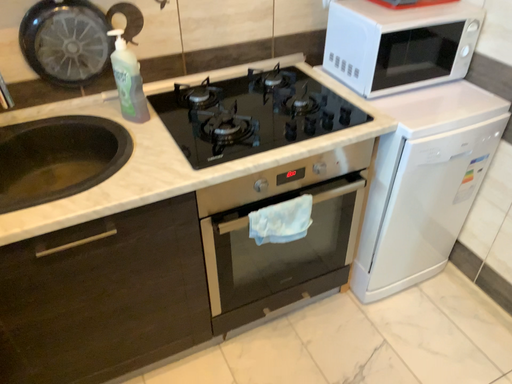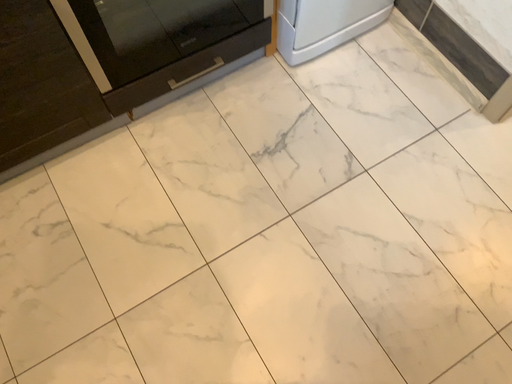
Question: Which way did the camera rotate in the video?

Choices:
 (A) rotated upward
 (B) rotated downward

Answer: (B)